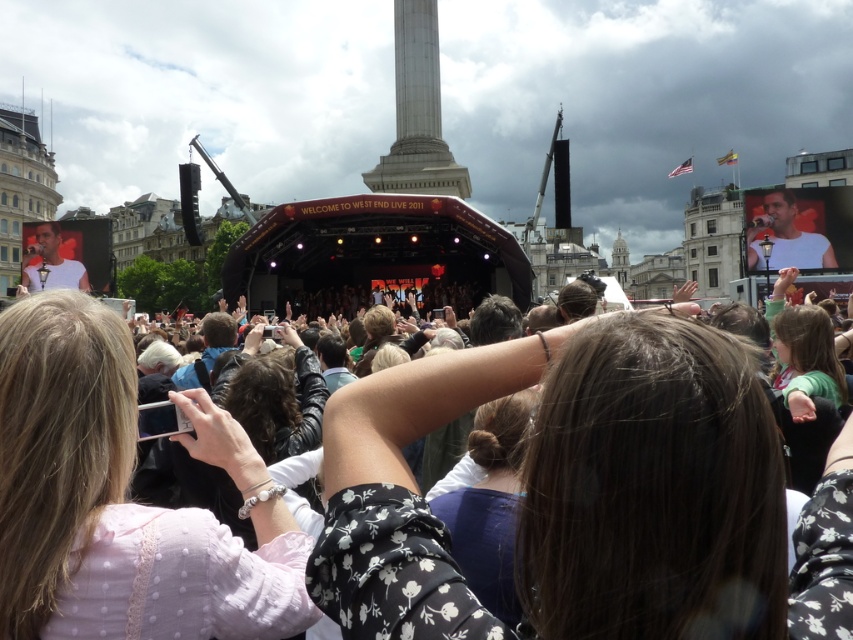
From the picture: You are at the concert in Trafalgar Square and want to take a photo of the stage without anyone blocking your view. There is a person wearing a black floral shirt at center. Where should you stand to avoid their view?

The black floral shirt at center is located at point [589,496]. To avoid their view, you should position yourself either to the left or right of this coordinate, ensuring the person is not directly in front of the stage.

You are a photographer at the concert and want to take a photo of the black floral shirt at center and the pink fabric at center. Which one is shorter in height?

The black floral shirt at center has a lesser height compared to the pink fabric at center, so the black floral shirt at center is shorter.

You are standing at the point marked as point (329, 552) in the image. The stage is located behind you. Can you see the stage from your current position?

The distance of point (329, 552) from camera is 57.71 meters. Since the stage is behind you, you cannot see it from your current position.